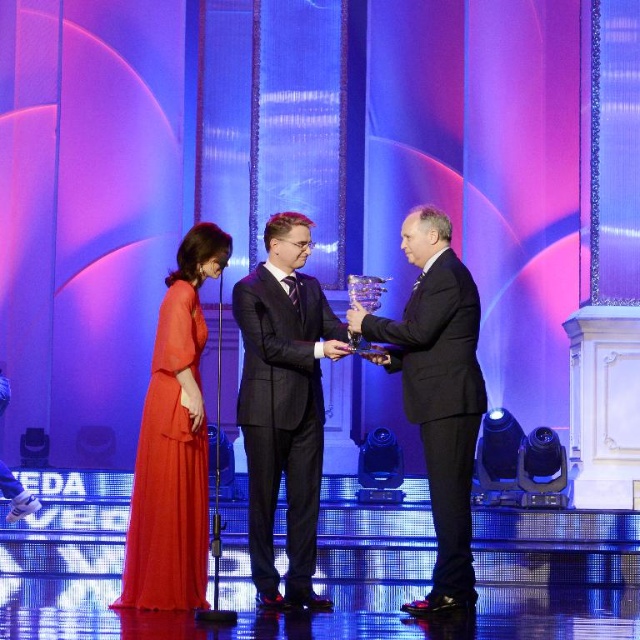
Question: Does dark gray suit at center have a smaller size compared to matte orange dress at center?

Choices:
 (A) yes
 (B) no

Answer: (B)

Question: Does black glossy suit at center have a larger size compared to matte orange dress at center?

Choices:
 (A) no
 (B) yes

Answer: (B)

Question: Considering the real-world distances, which object is closest to the matte orange dress at center?

Choices:
 (A) black glossy suit at center
 (B) dark gray suit at center

Answer: (B)

Question: Does dark gray suit at center have a lesser width compared to black glossy suit at center?

Choices:
 (A) no
 (B) yes

Answer: (B)

Question: Which object appears closest to the camera in this image?

Choices:
 (A) matte orange dress at center
 (B) black glossy suit at center

Answer: (A)

Question: Estimate the real-world distances between objects in this image. Which object is closer to the dark gray suit at center?

Choices:
 (A) matte orange dress at center
 (B) black glossy suit at center

Answer: (A)